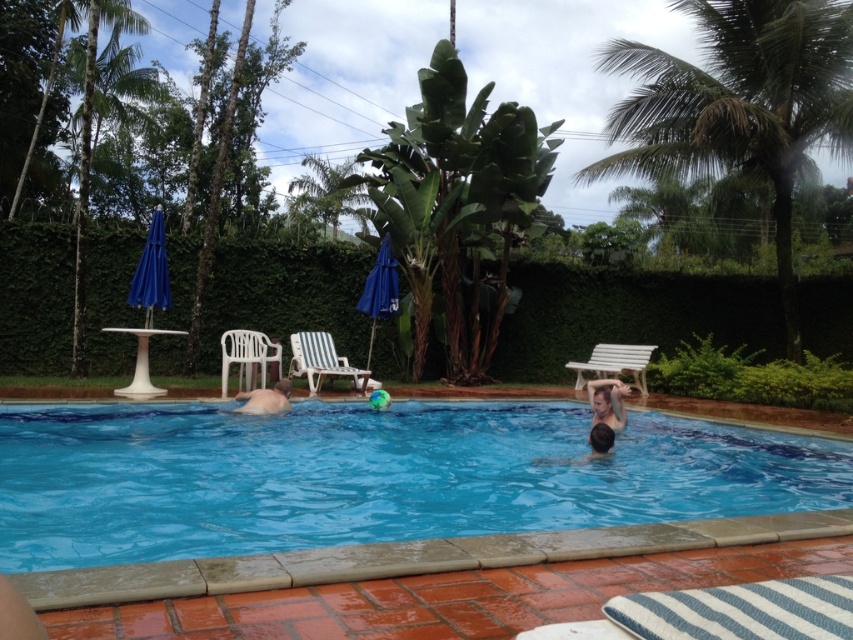
Who is positioned more to the right, green leafy palm tree at upper right or smooth skin person at center?

green leafy palm tree at upper right

Is green leafy palm tree at upper right thinner than smooth skin person at center?

Yes.

At what (x,y) coordinates should I click in order to perform the action: click on green leafy palm tree at upper right. Please return your answer as a coordinate pair (x, y). This screenshot has height=640, width=853. Looking at the image, I should click on pyautogui.click(x=740, y=106).

Who is shorter, green leafy palm tree at left or white plastic bench at upper right?

white plastic bench at upper right

Is point (111, 12) closer to viewer compared to point (640, 378)?

No, it is behind (640, 378).

Looking at this image, who is more distant from viewer, (83, 296) or (602, 378)?

Positioned behind is point (602, 378).

Identify the location of green leafy palm tree at left. Image resolution: width=853 pixels, height=640 pixels. (83, 131).

Can you confirm if clear blue water at center is bigger than green leafy palm tree at center?

Actually, clear blue water at center might be smaller than green leafy palm tree at center.

What are the coordinates of `clear blue water at center` in the screenshot? It's located at 369,476.